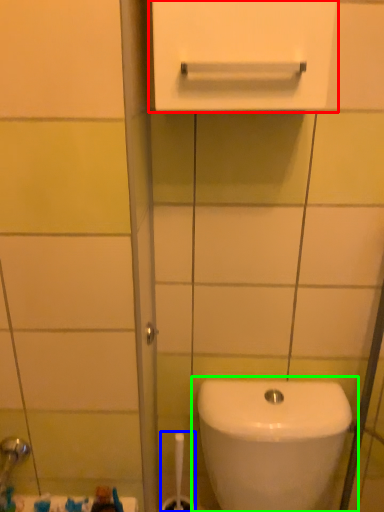
Question: Which object is the closest to the medicine cabinet (highlighted by a red box)? Choose among these: brush (highlighted by a blue box) or toilet (highlighted by a green box).

Choices:
 (A) brush
 (B) toilet

Answer: (B)